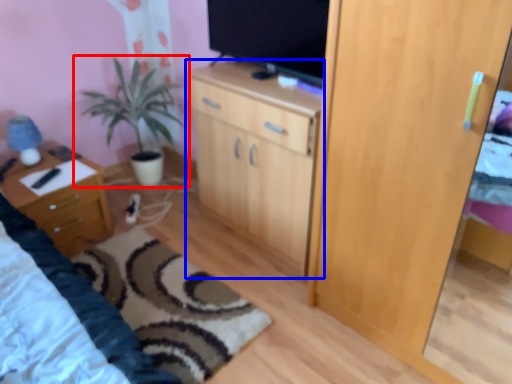
Question: Which point is further to the camera, houseplant (highlighted by a red box) or cabinetry (highlighted by a blue box)?

Choices:
 (A) houseplant
 (B) cabinetry

Answer: (A)